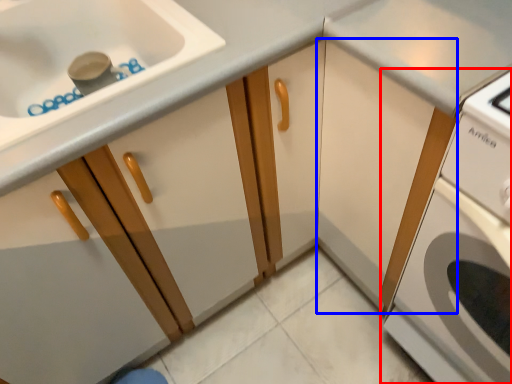
Question: Which object is further to the camera taking this photo, home appliance (highlighted by a red box) or cabinetry (highlighted by a blue box)?

Choices:
 (A) home appliance
 (B) cabinetry

Answer: (B)